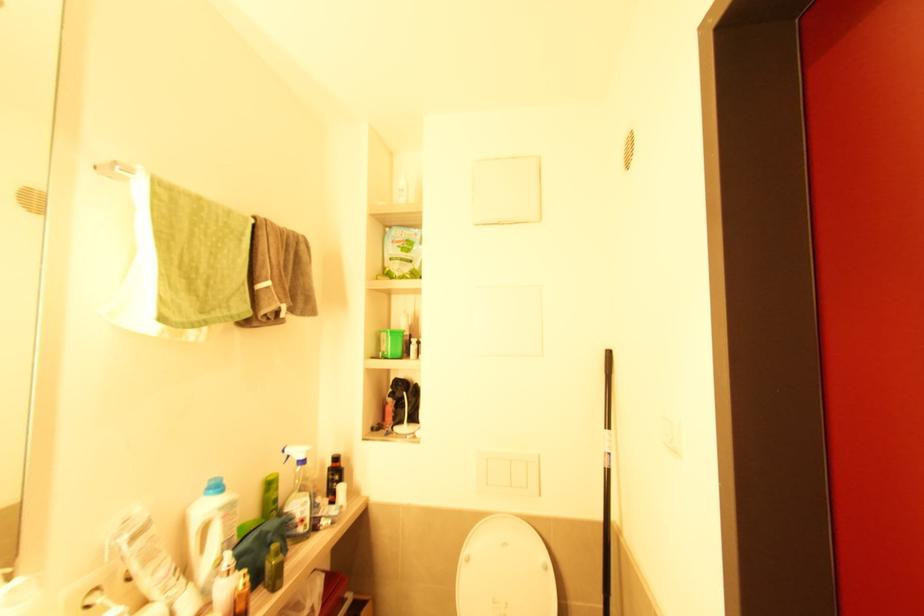
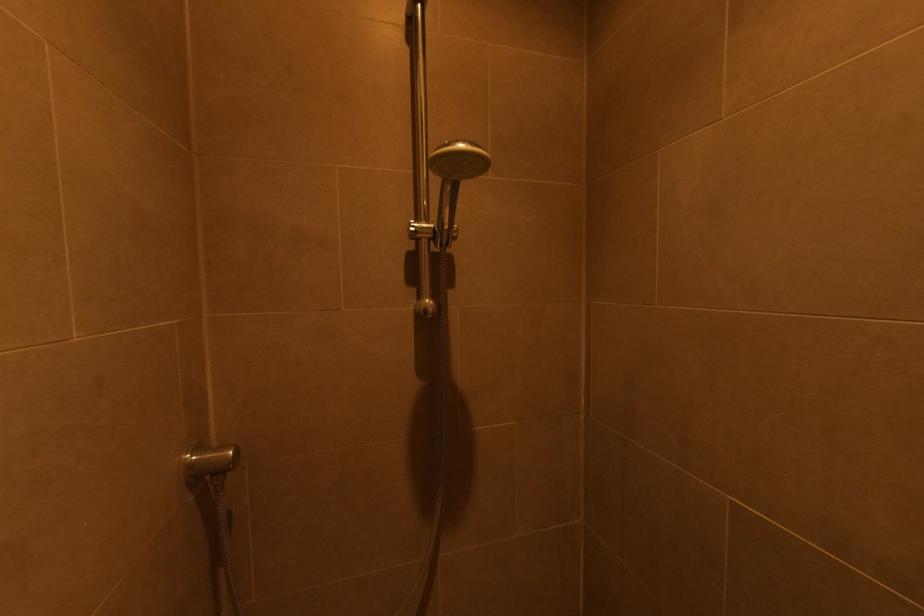
Question: How did the camera likely rotate?

Choices:
 (A) Left
 (B) Right
 (C) Up
 (D) Down

Answer: (A)